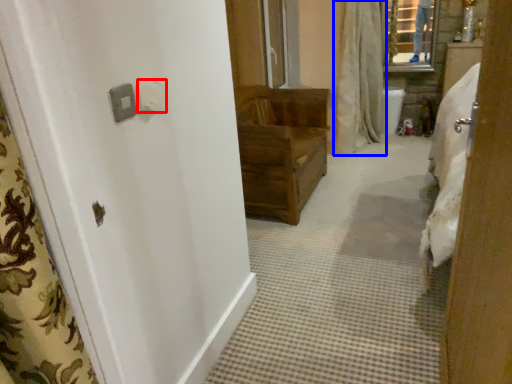
Question: Among these objects, which one is nearest to the camera, light switch (highlighted by a red box) or shower curtain (highlighted by a blue box)?

Choices:
 (A) light switch
 (B) shower curtain

Answer: (A)